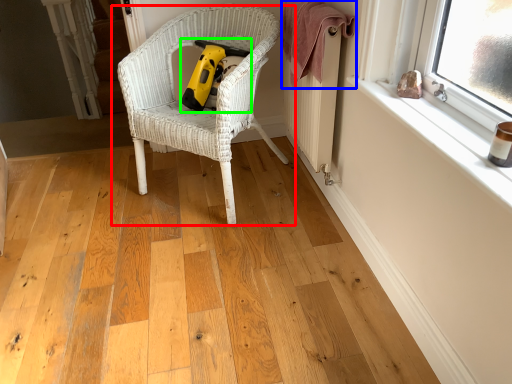
Question: Estimate the real-world distances between objects in this image. Which object is farther from chair (highlighted by a red box), blanket (highlighted by a blue box) or vacuum (highlighted by a green box)?

Choices:
 (A) blanket
 (B) vacuum

Answer: (A)